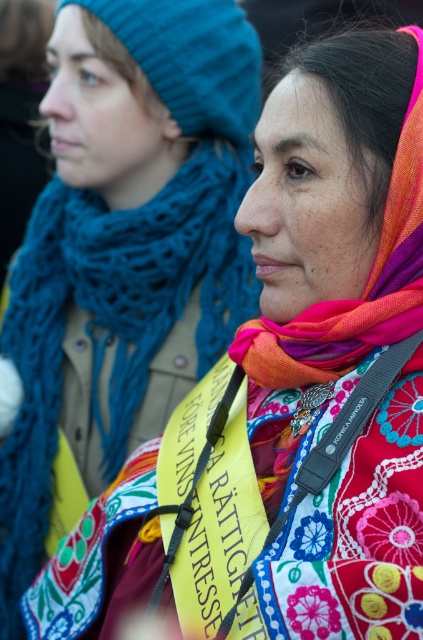
Question: Which point appears farthest from the camera in this image?

Choices:
 (A) (371, 344)
 (B) (47, 435)

Answer: (B)

Question: Is multicolored woven scarf at center below knitted blue scarf at left?

Choices:
 (A) yes
 (B) no

Answer: (B)

Question: Does multicolored woven scarf at center have a larger size compared to knitted blue scarf at left?

Choices:
 (A) yes
 (B) no

Answer: (B)

Question: Which object appears farthest from the camera in this image?

Choices:
 (A) knitted blue scarf at left
 (B) multicolored woven scarf at center

Answer: (A)

Question: Does multicolored woven scarf at center appear over knitted blue scarf at left?

Choices:
 (A) no
 (B) yes

Answer: (B)